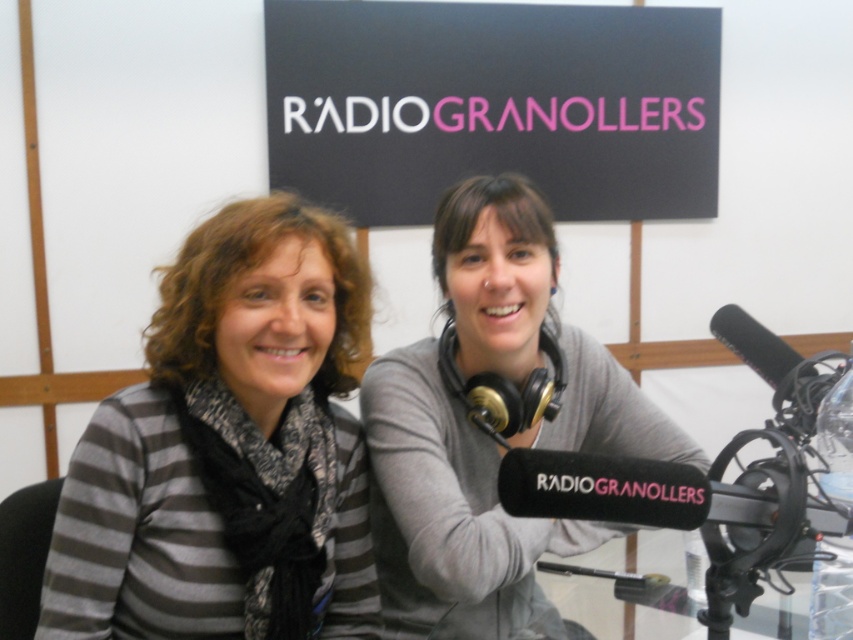
Question: Which point is closer to the camera?

Choices:
 (A) (403, 221)
 (B) (775, 360)

Answer: (B)

Question: Which of the following is the farthest from the observer?

Choices:
 (A) striped fabric shirt at left
 (B) black matte microphone at right
 (C) black matte signboard at upper center
 (D) black matte microphone at lower right

Answer: (C)

Question: Is striped fabric shirt at left bigger than black matte microphone at lower right?

Choices:
 (A) no
 (B) yes

Answer: (A)

Question: Is striped fabric shirt at left smaller than black matte microphone at lower right?

Choices:
 (A) yes
 (B) no

Answer: (A)

Question: Which object is closer to the camera taking this photo?

Choices:
 (A) striped fabric shirt at left
 (B) black matte signboard at upper center

Answer: (A)

Question: Is black matte signboard at upper center thinner than black matte microphone at lower right?

Choices:
 (A) no
 (B) yes

Answer: (A)